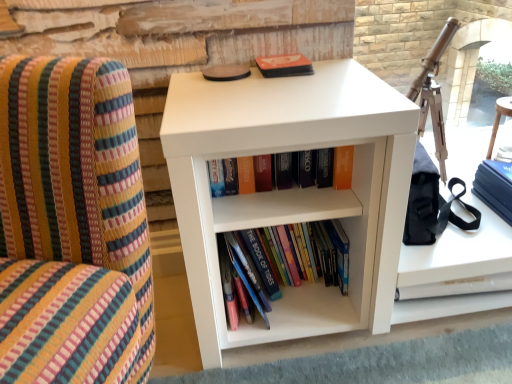
Question: From the image's perspective, is white matte cabinet at lower right on matte orange book at center, which ranks as the 1th book in top-to-bottom order?

Choices:
 (A) no
 (B) yes

Answer: (A)

Question: Does white matte cabinet at lower right have a greater height compared to matte orange book at center, positioned as the second book in bottom-to-top order?

Choices:
 (A) yes
 (B) no

Answer: (B)

Question: From the image's perspective, is white matte cabinet at lower right under matte orange book at center, which ranks as the 1th book in top-to-bottom order?

Choices:
 (A) no
 (B) yes

Answer: (B)

Question: Is matte orange book at center, positioned as the second book in bottom-to-top order, inside white matte cabinet at lower right?

Choices:
 (A) no
 (B) yes

Answer: (A)

Question: Does white matte cabinet at lower right have a greater width compared to matte orange book at center, which ranks as the 1th book in top-to-bottom order?

Choices:
 (A) yes
 (B) no

Answer: (A)

Question: Is white matte cabinet at lower right outside matte orange book at center, positioned as the second book in bottom-to-top order?

Choices:
 (A) yes
 (B) no

Answer: (A)

Question: From a real-world perspective, is matte orange book at center, which ranks as the 1th book in top-to-bottom order, beneath white matte cabinet at lower right?

Choices:
 (A) yes
 (B) no

Answer: (B)

Question: Does matte orange book at center, which ranks as the 1th book in top-to-bottom order, have a lesser width compared to white matte cabinet at lower right?

Choices:
 (A) yes
 (B) no

Answer: (A)

Question: Considering the relative positions of matte orange book at center, positioned as the second book in bottom-to-top order, and white matte cabinet at lower right in the image provided, is matte orange book at center, positioned as the second book in bottom-to-top order, behind white matte cabinet at lower right?

Choices:
 (A) no
 (B) yes

Answer: (A)

Question: From a real-world perspective, is matte orange book at center, which ranks as the 1th book in top-to-bottom order, on top of white matte cabinet at lower right?

Choices:
 (A) no
 (B) yes

Answer: (B)

Question: Considering the relative sizes of matte orange book at center, which ranks as the 1th book in top-to-bottom order, and white matte cabinet at lower right in the image provided, is matte orange book at center, which ranks as the 1th book in top-to-bottom order, smaller than white matte cabinet at lower right?

Choices:
 (A) no
 (B) yes

Answer: (B)

Question: Is matte orange book at center, which ranks as the 1th book in top-to-bottom order, to the left of white matte cabinet at lower right from the viewer's perspective?

Choices:
 (A) no
 (B) yes

Answer: (B)

Question: Is matte orange paperback book at upper center, marked as the first paperback book in a left-to-right arrangement, positioned far away from white matte bookshelf at center?

Choices:
 (A) no
 (B) yes

Answer: (A)